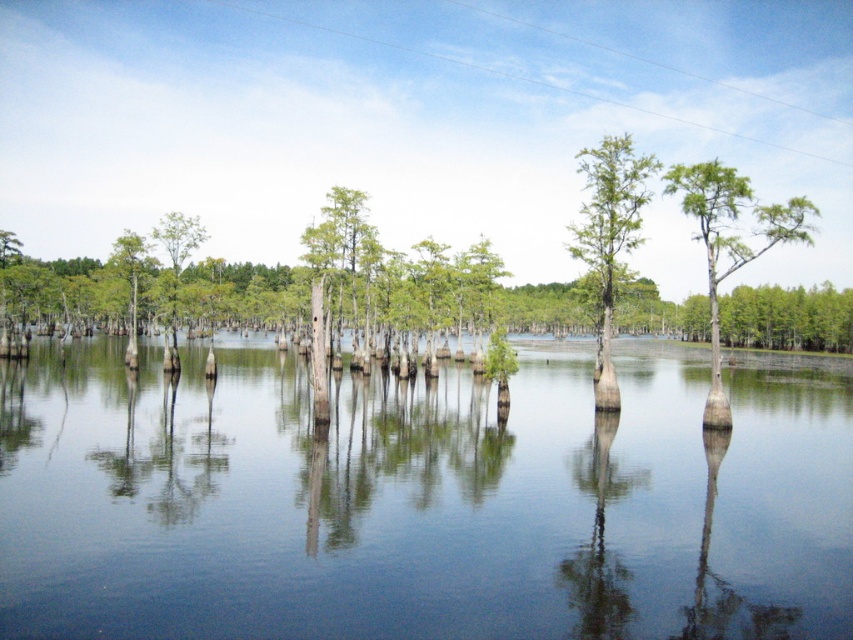
You are standing at the edge of the swamp and see the point labeled as point (422, 499) in the image. Based on the scene description, what type of surface is located at this point?

The point (422, 499) is on clear water at center, so the surface at this point is clear water.

You are a photographer standing in the swamp and want to capture the clear water at center and the green matte tree at center in your shot. Which object should you position closer to the left side of your camera frame?

The clear water at center should be positioned closer to the left side of your camera frame because it is located to the left of the green matte tree at center according to the description.

You are standing in the swamp and see two points marked in the image. Which point is nearer to you, point (x=329, y=522) or point (x=601, y=285)?

Point (x=329, y=522) is closer to the viewer than point (x=601, y=285).